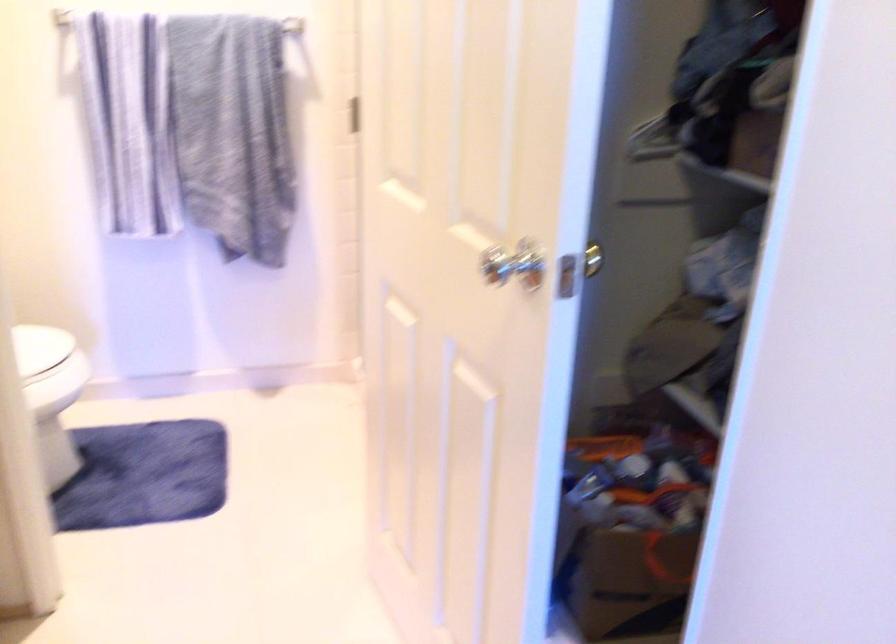
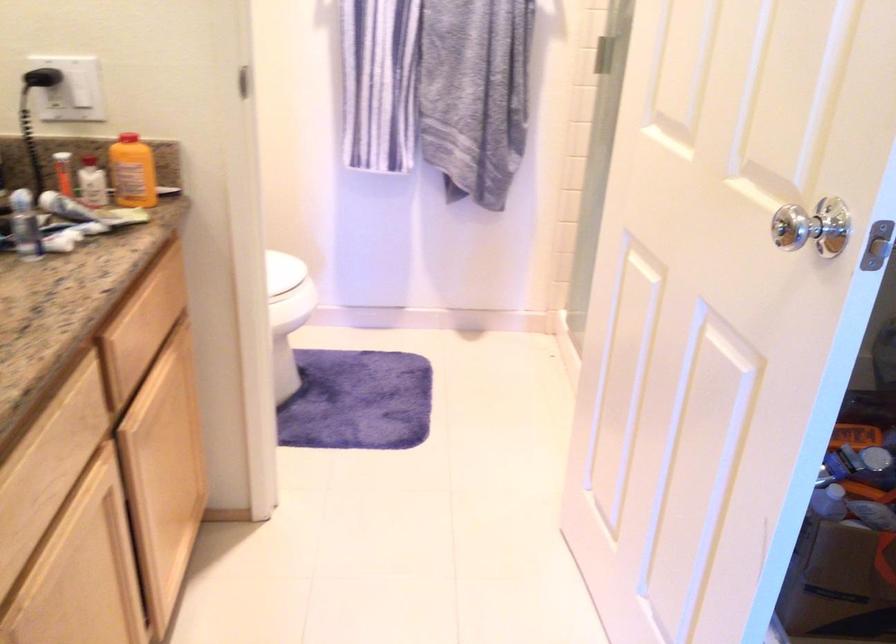
Question: The images are taken continuously from a first-person perspective. In which direction are you moving?

Choices:
 (A) Left
 (B) Right
 (C) Forward
 (D) Backward

Answer: (A)